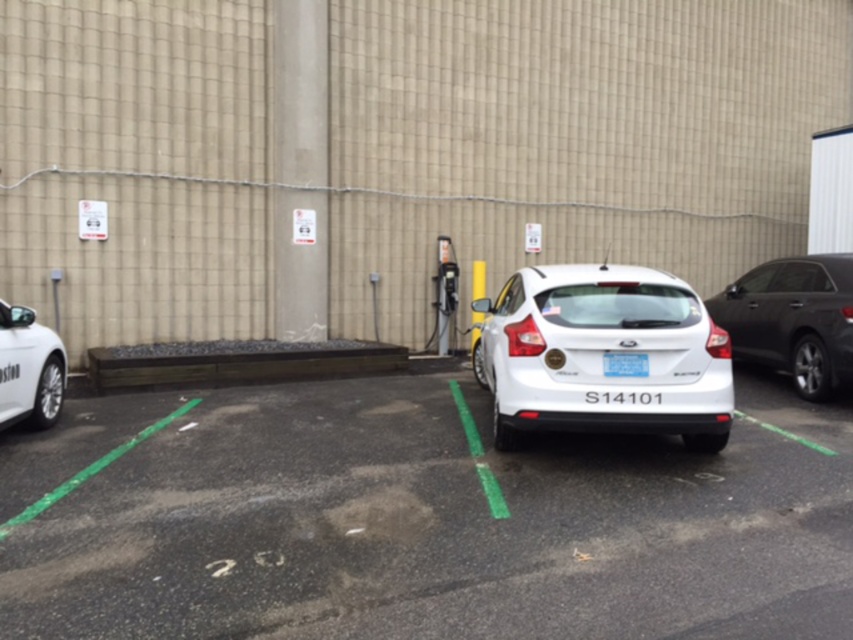
Consider the image. You are a parking attendant who needs to direct a car to park in the parking space where the white matte hatchback at center is currently parked. However, the car you are directing is wider than the existing parking space. Can the blue matte license plate at center be moved to make space?

The white matte hatchback at center is to the left of the blue matte license plate at center. Since the license plate is part of the car, it cannot be moved independently to create space for a wider vehicle.

You are a delivery person trying to park your 15.5 foot long delivery van between the white glossy car at center and the white matte car at left. Can you fit your van between them without touching either car?

The distance between the white glossy car at center and the white matte car at left is 17.75 feet. Since your delivery van is 15.5 feet long, there is enough space to park between them without touching either car.